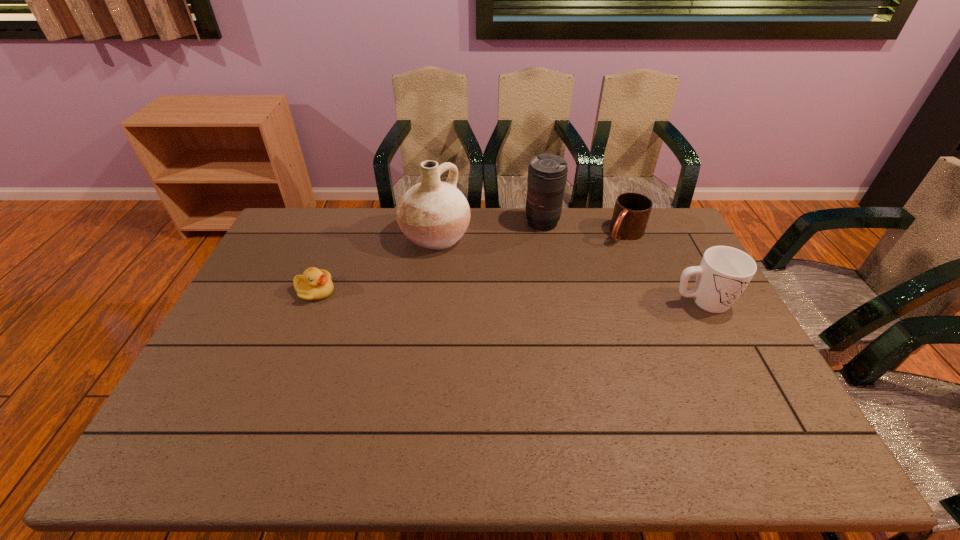
Locate an element on the screen. The width and height of the screenshot is (960, 540). mug located at the far edge is located at coordinates (631, 212).

You are a GUI agent. You are given a task and a screenshot of the screen. Output one action in this format:
    pyautogui.click(x=<x>, y=<y>)
    Task: Click on the telephoto lens that is at the far edge
    The height and width of the screenshot is (540, 960).
    Given the screenshot: What is the action you would take?
    tap(547, 173)

Where is `object positioned at the left edge`? object positioned at the left edge is located at coordinates (315, 284).

What are the coordinates of `object that is positioned at the far right corner` in the screenshot? It's located at (631, 212).

Identify the location of vacant region at the far edge of the desktop. This screenshot has height=540, width=960. (391, 226).

I want to click on vacant space at the near edge of the desktop, so click(663, 401).

Where is `free region at the left edge of the desktop`? free region at the left edge of the desktop is located at coordinates (232, 309).

Locate an element on the screen. This screenshot has width=960, height=540. vacant space at the right edge of the desktop is located at coordinates (706, 338).

The height and width of the screenshot is (540, 960). I want to click on vacant space at the near left corner of the desktop, so click(225, 388).

Identify the location of blank space at the near right corner. (729, 418).